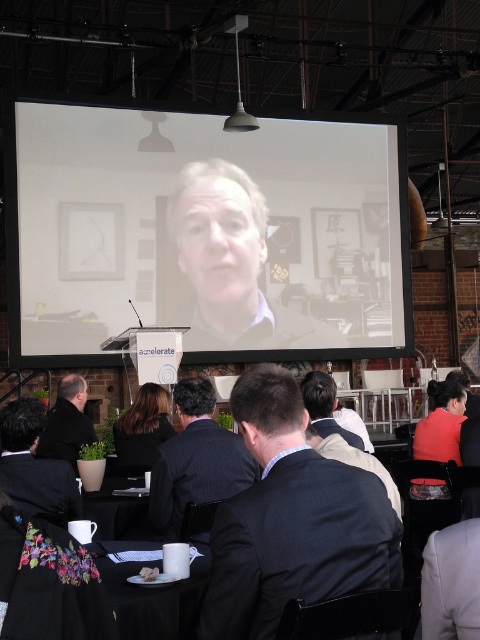
Question: Which object is closer to the camera taking this photo?

Choices:
 (A) smooth skin face at center
 (B) dark blue pinstripe suit at center
 (C) matte brown suit at center
 (D) black suit at lower left

Answer: (D)

Question: Which object is positioned closest to the black plastic table at lower center?

Choices:
 (A) dark suit at center
 (B) white matte table at lower center
 (C) dark gray suit at center
 (D) dark blue pinstripe suit at center

Answer: (D)

Question: From the image, what is the correct spatial relationship of white matte table at lower center in relation to black plastic table at lower center?

Choices:
 (A) below
 (B) above

Answer: (B)

Question: Estimate the real-world distances between objects in this image. Which object is closer to the dark suit at lower left?

Choices:
 (A) dark blue pinstripe suit at center
 (B) black plastic table at lower center
 (C) black suit at lower left

Answer: (B)

Question: Is dark blue pinstripe suit at center thinner than black plastic table at lower center?

Choices:
 (A) no
 (B) yes

Answer: (A)

Question: Is dark suit at center positioned before white matte table at lower center?

Choices:
 (A) no
 (B) yes

Answer: (B)